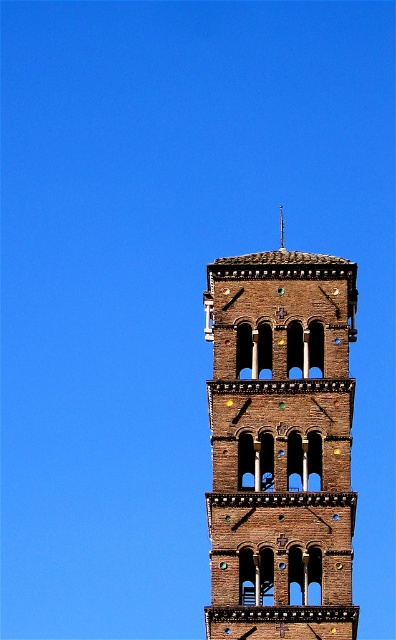
Who is taller, brown brick tower at center or brown stone spire at center?

Standing taller between the two is brown brick tower at center.

Is point (241, 541) closer to viewer compared to point (279, 211)?

Yes, it is.

Does point (232, 420) come closer to viewer compared to point (279, 209)?

Yes, point (232, 420) is closer to viewer.

What are the coordinates of `brown brick tower at center` in the screenshot? It's located at (281, 445).